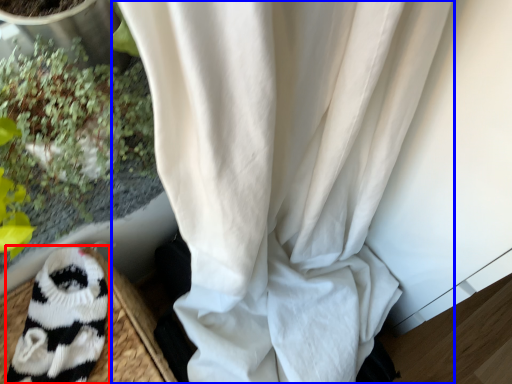
Question: Which of the following is the farthest to the observer, animal (highlighted by a red box) or curtain (highlighted by a blue box)?

Choices:
 (A) animal
 (B) curtain

Answer: (B)